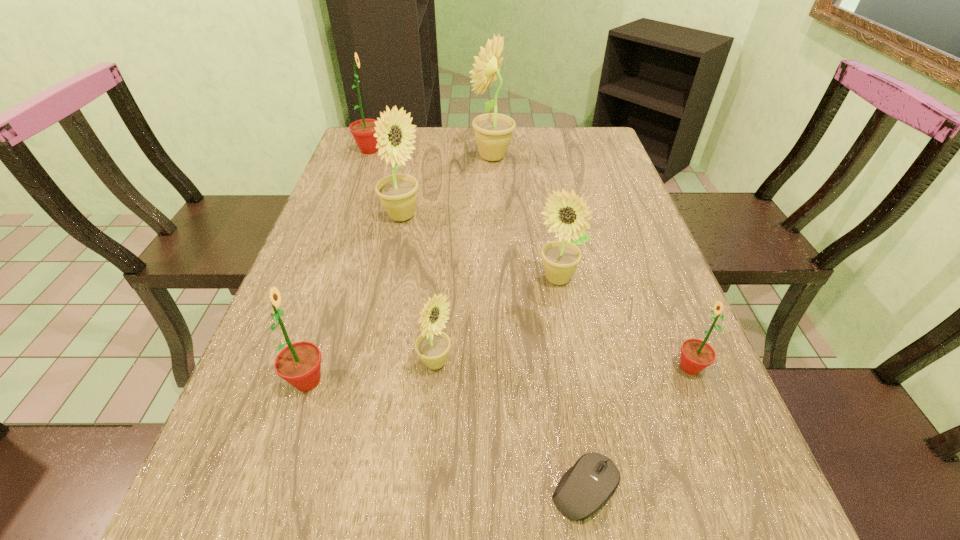
This screenshot has width=960, height=540. Find the location of `vacant space that satisfies the following two spatial constraints: 1. on the face of the fourth sunflower from right to left; 2. on the left side of the nearest object`. vacant space that satisfies the following two spatial constraints: 1. on the face of the fourth sunflower from right to left; 2. on the left side of the nearest object is located at coordinates (424, 488).

Find the location of a particular element. vacant region that satisfies the following two spatial constraints: 1. on the face of the fifth object from right to left; 2. on the left side of the shortest object is located at coordinates (424, 488).

Find the location of `free point that satisfies the following two spatial constraints: 1. on the face of the fifth nearest sunflower; 2. on the left side of the nearest object`. free point that satisfies the following two spatial constraints: 1. on the face of the fifth nearest sunflower; 2. on the left side of the nearest object is located at coordinates [344, 488].

Image resolution: width=960 pixels, height=540 pixels. Find the location of `free space that satisfies the following two spatial constraints: 1. on the face of the third sunflower from right to left; 2. on the back side of the nearest object`. free space that satisfies the following two spatial constraints: 1. on the face of the third sunflower from right to left; 2. on the back side of the nearest object is located at coordinates (506, 488).

This screenshot has height=540, width=960. I want to click on vacant point that satisfies the following two spatial constraints: 1. on the face of the fourth object from right to left; 2. on the back side of the black computer equipment, so click(x=506, y=488).